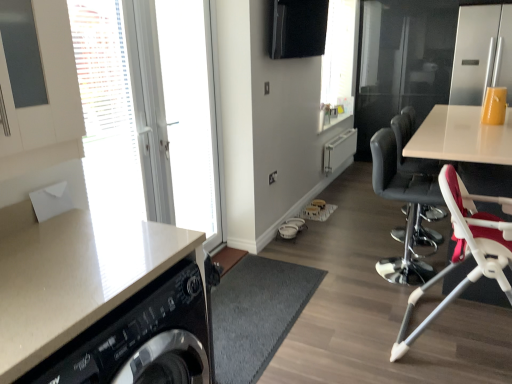
Question: Can you confirm if white glossy door at left, which ranks as the second window in back-to-front order, is taller than black leather chair at right, which appears as the 1th chair when viewed from the back?

Choices:
 (A) yes
 (B) no

Answer: (A)

Question: Is white glossy door at left, the first window when ordered from front to back, looking in the opposite direction of black leather chair at right, which appears as the 2th chair when viewed from the front?

Choices:
 (A) no
 (B) yes

Answer: (A)

Question: Is white glossy door at left, the first window when ordered from front to back, further to the viewer compared to black leather chair at right, which appears as the 2th chair when viewed from the front?

Choices:
 (A) no
 (B) yes

Answer: (A)

Question: Is white glossy door at left, the first window when ordered from front to back, at the right side of black leather chair at right, which appears as the 2th chair when viewed from the front?

Choices:
 (A) no
 (B) yes

Answer: (A)

Question: Does white glossy door at left, which ranks as the second window in back-to-front order, turn towards black leather chair at right, which appears as the 1th chair when viewed from the back?

Choices:
 (A) no
 (B) yes

Answer: (A)

Question: From the image's perspective, is white glossy door at left, which ranks as the second window in back-to-front order, located above black leather chair at right, which appears as the 2th chair when viewed from the front?

Choices:
 (A) yes
 (B) no

Answer: (A)

Question: Can you confirm if red fabric high chair at right, arranged as the first chair when viewed from the front, is shorter than black leather chair at right, which appears as the 1th chair when viewed from the back?

Choices:
 (A) no
 (B) yes

Answer: (B)

Question: Does red fabric high chair at right, positioned as the second chair in back-to-front order, appear on the left side of black leather chair at right, which appears as the 2th chair when viewed from the front?

Choices:
 (A) no
 (B) yes

Answer: (A)

Question: Considering the relative sizes of red fabric high chair at right, arranged as the first chair when viewed from the front, and black leather chair at right, which appears as the 2th chair when viewed from the front, in the image provided, is red fabric high chair at right, arranged as the first chair when viewed from the front, smaller than black leather chair at right, which appears as the 2th chair when viewed from the front,?

Choices:
 (A) no
 (B) yes

Answer: (A)

Question: Are red fabric high chair at right, arranged as the first chair when viewed from the front, and black leather chair at right, which appears as the 2th chair when viewed from the front, beside each other?

Choices:
 (A) yes
 (B) no

Answer: (B)

Question: From a real-world perspective, is red fabric high chair at right, arranged as the first chair when viewed from the front, over black leather chair at right, which appears as the 1th chair when viewed from the back?

Choices:
 (A) yes
 (B) no

Answer: (B)

Question: Considering the relative positions of red fabric high chair at right, arranged as the first chair when viewed from the front, and black leather chair at right, which appears as the 2th chair when viewed from the front, in the image provided, is red fabric high chair at right, arranged as the first chair when viewed from the front, in front of black leather chair at right, which appears as the 2th chair when viewed from the front,?

Choices:
 (A) yes
 (B) no

Answer: (A)

Question: From a real-world perspective, is transparent glass window screen at upper center, which appears as the first window screen when viewed from the back, located higher than white glossy countertop at lower left?

Choices:
 (A) no
 (B) yes

Answer: (B)